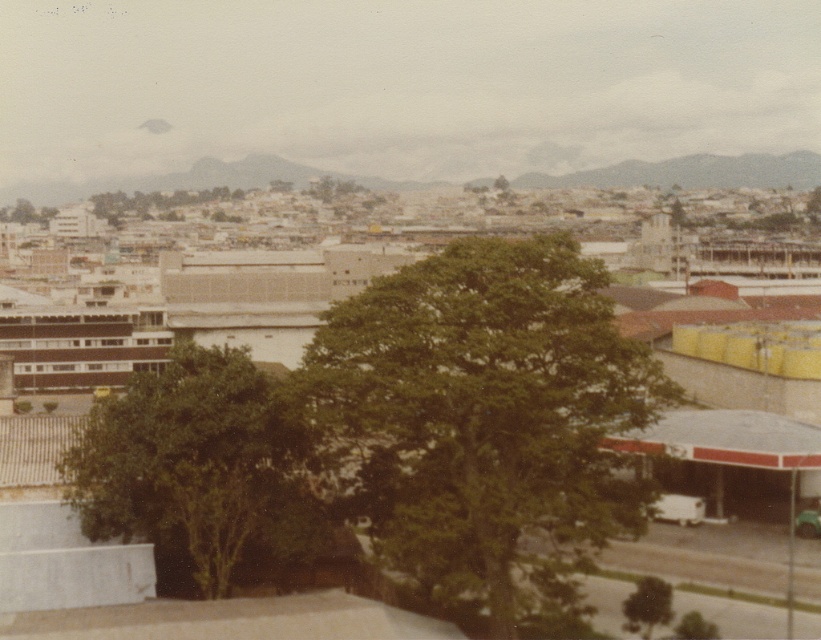
Question: Where is green leafy tree at center located in relation to green leafy tree at lower center in the image?

Choices:
 (A) right
 (B) left

Answer: (B)

Question: Which point appears closest to the camera in this image?

Choices:
 (A) (709, 620)
 (B) (264, 380)
 (C) (488, 595)

Answer: (C)

Question: Can you confirm if green leafy tree at center is wider than green leafy tree at lower center?

Choices:
 (A) no
 (B) yes

Answer: (B)

Question: Which of these objects is positioned farthest from the green leafy tree at lower center?

Choices:
 (A) green leafy tree at lower right
 (B) green leafy tree at center

Answer: (B)

Question: Does green leafy tree at lower right have a smaller size compared to green leafy tree at lower center?

Choices:
 (A) no
 (B) yes

Answer: (A)

Question: Which point is closer to the camera taking this photo?

Choices:
 (A) (695, 637)
 (B) (283, 476)
 (C) (652, 621)
 (D) (487, 500)

Answer: (D)